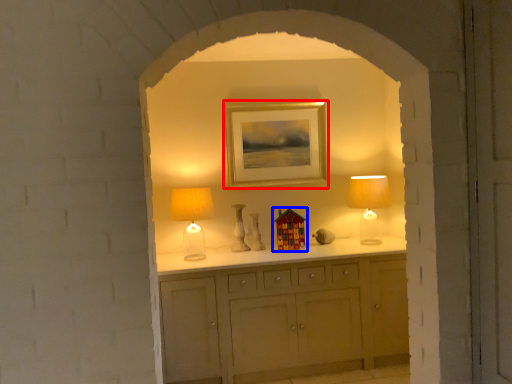
Question: Which object is further to the camera taking this photo, picture frame (highlighted by a red box) or art (highlighted by a blue box)?

Choices:
 (A) picture frame
 (B) art

Answer: (A)